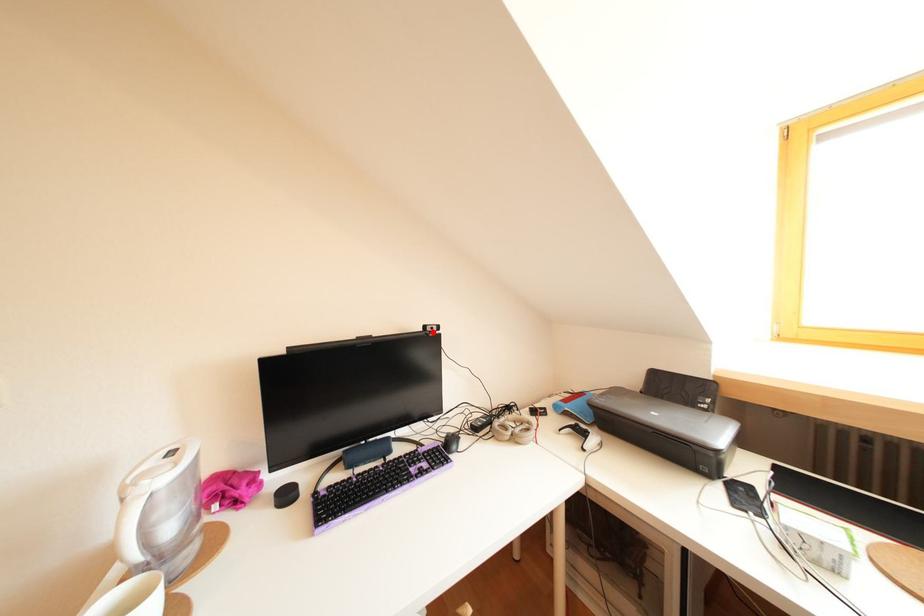
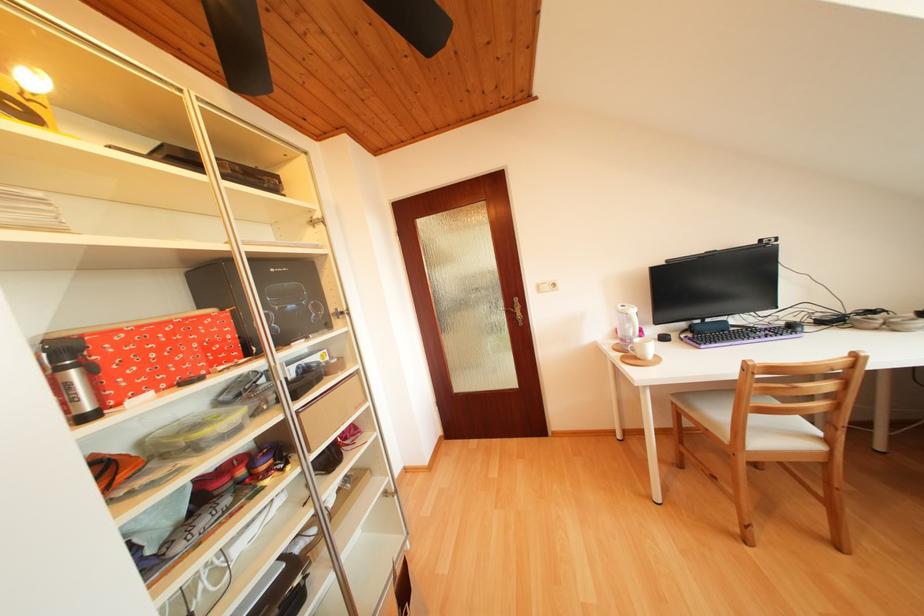
Where in the second image is the point corresponding to the highlighted location from the first image?

(769, 246)